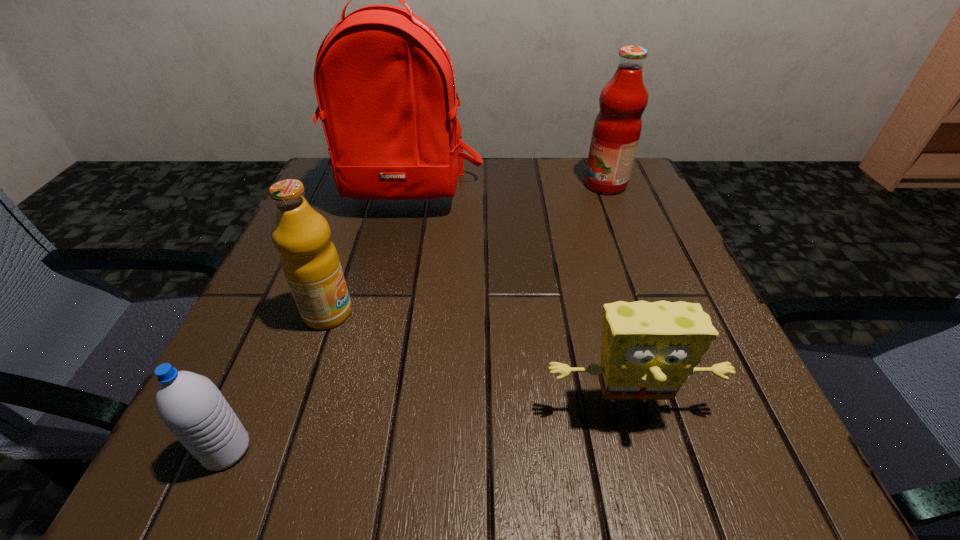
Locate an element on the screen. This screenshot has height=540, width=960. fruit juice at the right edge is located at coordinates (617, 128).

Locate an element on the screen. The image size is (960, 540). sponge positioned at the right edge is located at coordinates (648, 350).

In order to click on object located in the far left corner section of the desktop in this screenshot , I will do `click(385, 85)`.

Find the location of a particular element. object positioned at the near left corner is located at coordinates (190, 405).

This screenshot has width=960, height=540. Find the location of `object that is at the far right corner`. object that is at the far right corner is located at coordinates (617, 128).

This screenshot has width=960, height=540. Identify the location of object that is positioned at the near right corner. (648, 350).

You are a GUI agent. You are given a task and a screenshot of the screen. Output one action in this format:
    pyautogui.click(x=<x>, y=<y>)
    Task: Click on the vacant space at the far edge of the desktop
    This screenshot has height=540, width=960.
    Given the screenshot: What is the action you would take?
    pyautogui.click(x=555, y=172)

Image resolution: width=960 pixels, height=540 pixels. In order to click on vacant area at the near edge of the desktop in this screenshot , I will do `click(308, 461)`.

At what (x,y) coordinates should I click in order to perform the action: click on free space at the left edge. Please return your answer as a coordinate pair (x, y). Looking at the image, I should click on (349, 277).

The width and height of the screenshot is (960, 540). I want to click on blank space at the right edge of the desktop, so click(658, 408).